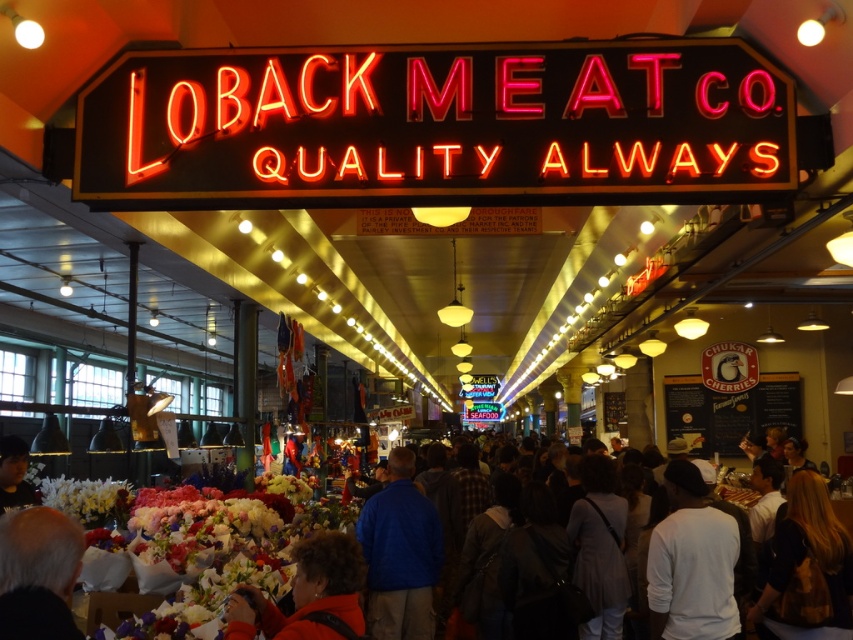
Question: Which point is farther to the camera?

Choices:
 (A) blue fabric jacket at center
 (B) red sweater at lower left
 (C) dark brown hair at center

Answer: (A)

Question: Can you confirm if dark gray clothing at center is positioned below white matte shirt at center?

Choices:
 (A) yes
 (B) no

Answer: (B)

Question: Which point appears farthest from the camera in this image?

Choices:
 (A) (311, 592)
 (B) (433, 554)
 (C) (686, 538)

Answer: (B)

Question: Which point is farther to the camera?

Choices:
 (A) blue fabric jacket at center
 (B) dark gray clothing at center

Answer: (A)

Question: Does white matte shirt at center appear under red sweater at lower left?

Choices:
 (A) no
 (B) yes

Answer: (B)

Question: Does dark brown hair at center lie behind gray hair at lower left?

Choices:
 (A) no
 (B) yes

Answer: (B)